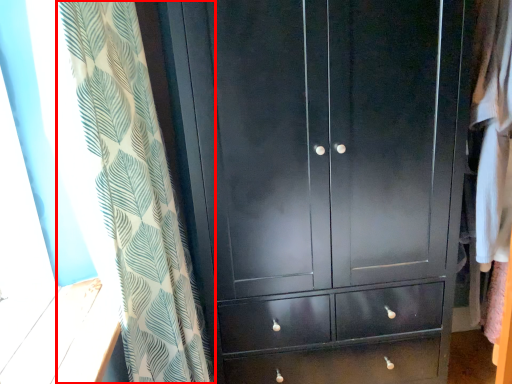
Question: In this image, where is curtain (annotated by the red box) located relative to cupboard?

Choices:
 (A) left
 (B) right

Answer: (A)